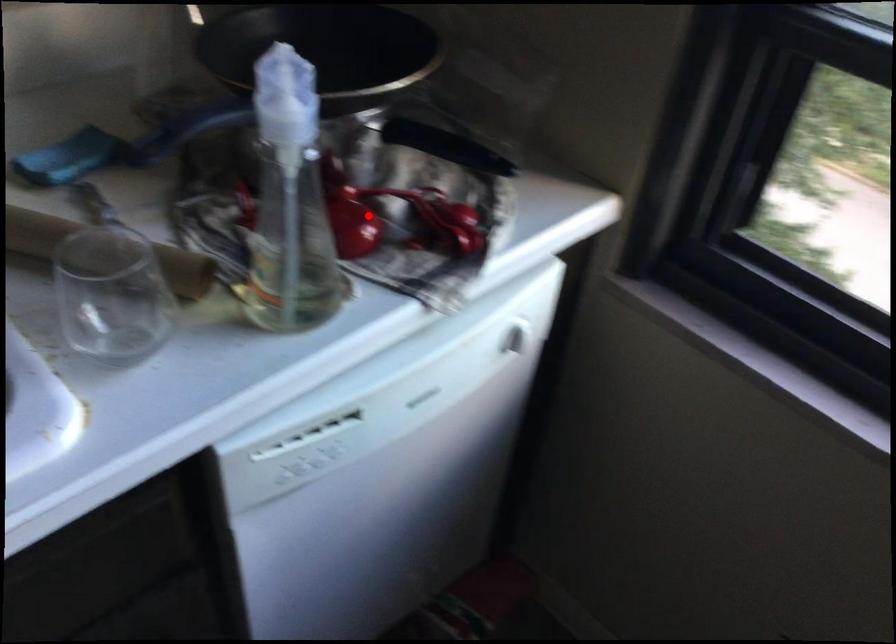
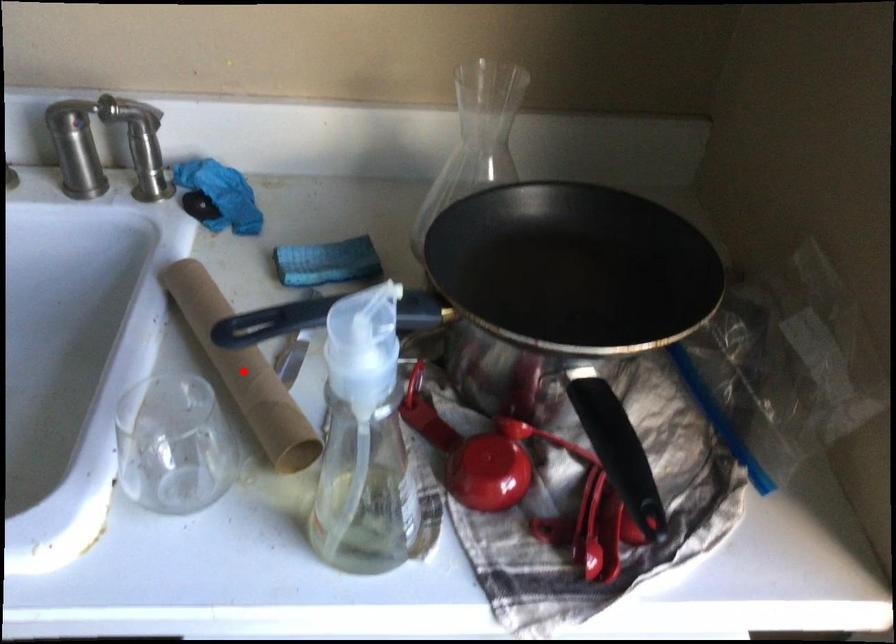
I am providing you with two images of the same scene from different viewpoints. A red point is marked on the first image and another point is marked on the second image. Are the points marked in image1 and image2 representing the same 3D position?

No